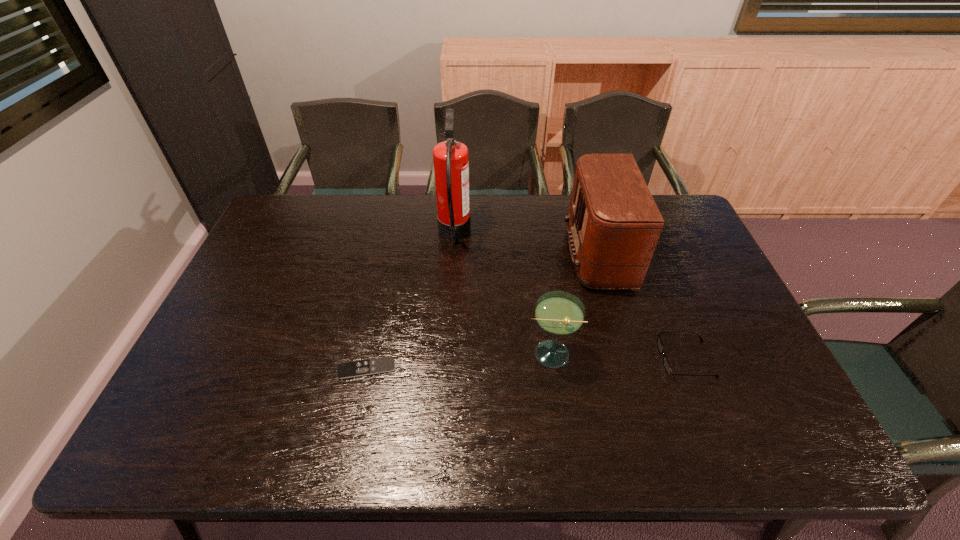
The height and width of the screenshot is (540, 960). What are the coordinates of `unoccupied position between the remote control and the fire extinguisher` in the screenshot? It's located at (410, 302).

You are a GUI agent. You are given a task and a screenshot of the screen. Output one action in this format:
    pyautogui.click(x=<x>, y=<y>)
    Task: Click on the vacant space in between the shortest object and the fourth tallest object
    The width and height of the screenshot is (960, 540).
    Given the screenshot: What is the action you would take?
    pyautogui.click(x=526, y=364)

Where is `free space between the third tallest object and the fire extinguisher`? The image size is (960, 540). free space between the third tallest object and the fire extinguisher is located at coordinates point(501,294).

Where is `vacant space in between the radio receiver and the second object from left to right`? The width and height of the screenshot is (960, 540). vacant space in between the radio receiver and the second object from left to right is located at coordinates (534, 245).

Where is `unoccupied position between the third tallest object and the fourth object from right to left`? The height and width of the screenshot is (540, 960). unoccupied position between the third tallest object and the fourth object from right to left is located at coordinates (501, 294).

You are a GUI agent. You are given a task and a screenshot of the screen. Output one action in this format:
    pyautogui.click(x=<x>, y=<y>)
    Task: Click on the blank region between the spectacles and the second tallest object
    The image size is (960, 540).
    Given the screenshot: What is the action you would take?
    pyautogui.click(x=649, y=307)

At what (x,y) coordinates should I click in order to perform the action: click on empty space between the second shortest object and the remote control. Please return your answer as a coordinate pair (x, y). Image resolution: width=960 pixels, height=540 pixels. Looking at the image, I should click on (526, 364).

Locate an element on the screen. The width and height of the screenshot is (960, 540). object that is the fourth nearest to the fourth shortest object is located at coordinates (385, 364).

At what (x,y) coordinates should I click in order to perform the action: click on object that is the second closest to the fourth tallest object. Please return your answer as a coordinate pair (x, y). This screenshot has height=540, width=960. Looking at the image, I should click on (559, 313).

Find the location of a particular element. This screenshot has width=960, height=540. vacant space that satisfies the following two spatial constraints: 1. on the front-facing side of the fourth object from right to left; 2. on the front side of the remote control is located at coordinates (445, 368).